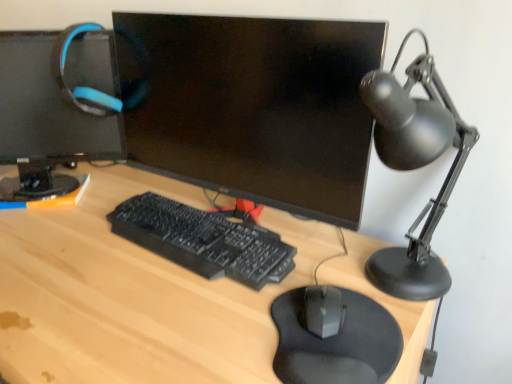
Identify the location of vacant region to the left of black matte mousepad at lower center. (198, 332).